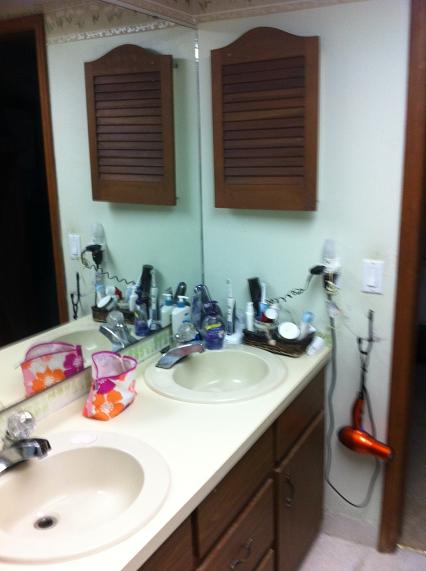
Identify the location of red hair dryer. This screenshot has width=426, height=571. (364, 446).